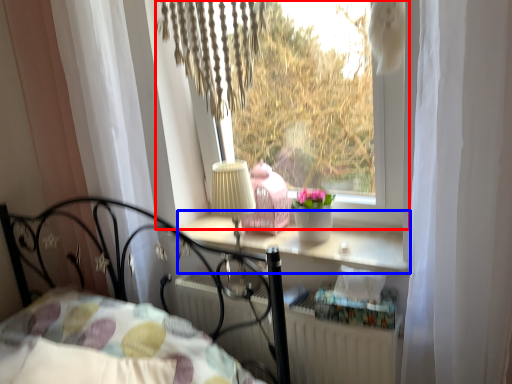
Question: Among these objects, which one is nearest to the camera, window (highlighted by a red box) or window sill (highlighted by a blue box)?

Choices:
 (A) window
 (B) window sill

Answer: (A)